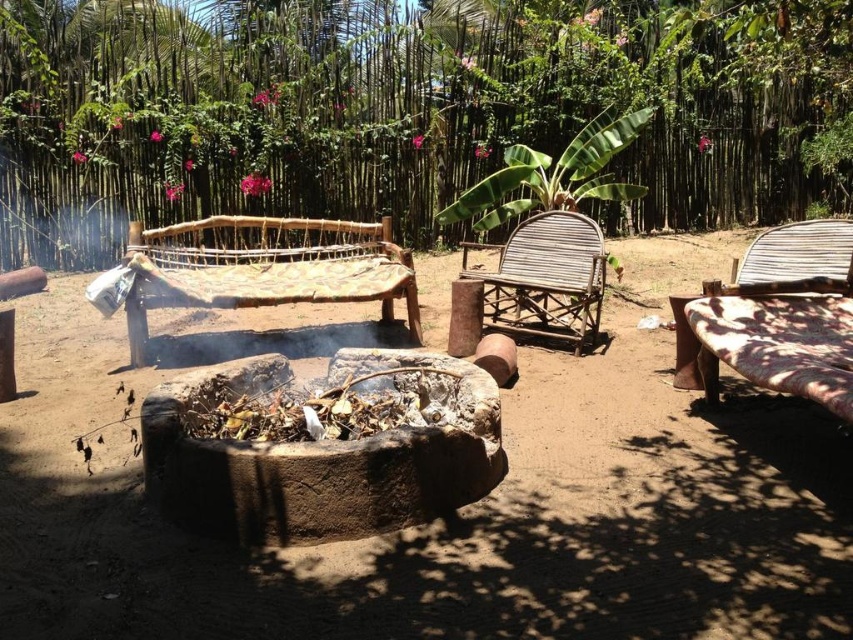
You are standing on the dull brown dirt at center and want to walk towards the brown bamboo forest at upper center. Which direction should you face to move towards it?

You should face to the right because the dull brown dirt at center is to the left of brown bamboo forest at upper center.

You are standing at the fire pit and want to walk towards the brown bamboo forest at upper center. Which direction should you head?

The brown bamboo forest at upper center is located at point [408,109], so you should head towards the upper center direction.

You are planning to set up a small garden in the area between the brown bamboo forest at upper center and the woven bamboo chair at center. Considering their sizes, which object would require more space to accommodate the garden?

The brown bamboo forest at upper center requires more space because its width is larger than the woven bamboo chair at center.